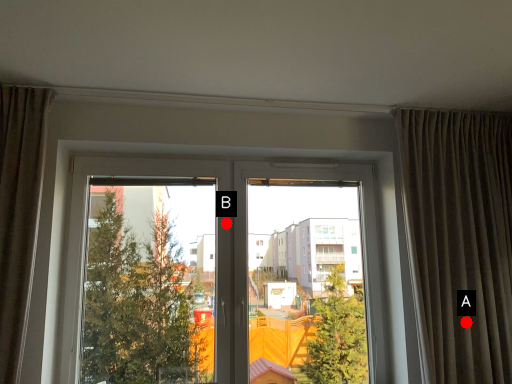
Question: Two points are circled on the image, labeled by A and B beside each circle. Which of the following is the farthest from the observer?

Choices:
 (A) A is further
 (B) B is further

Answer: (B)